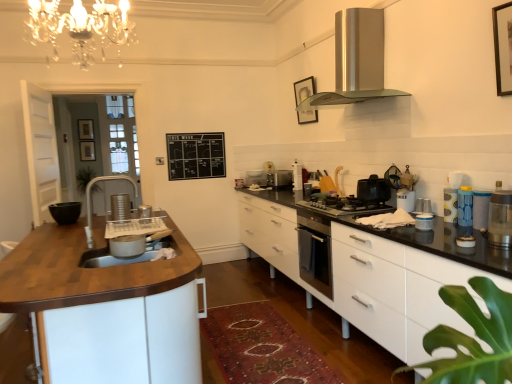
Find the location of a particular element. The image size is (512, 384). vacant space situated above black chalkboard at upper center (from a real-world perspective) is located at coordinates (207, 125).